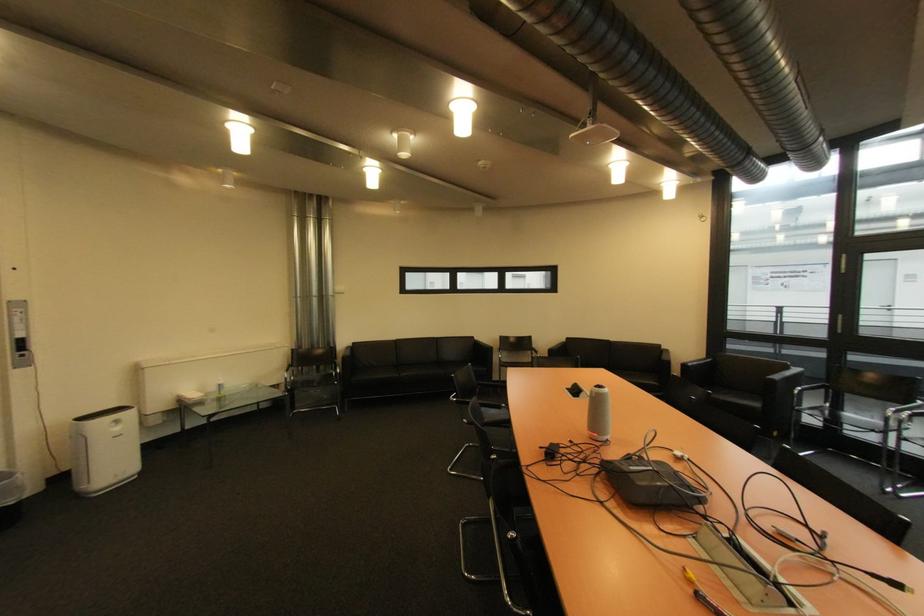
Where is `black conference phone`? This screenshot has width=924, height=616. black conference phone is located at coordinates (575, 391).